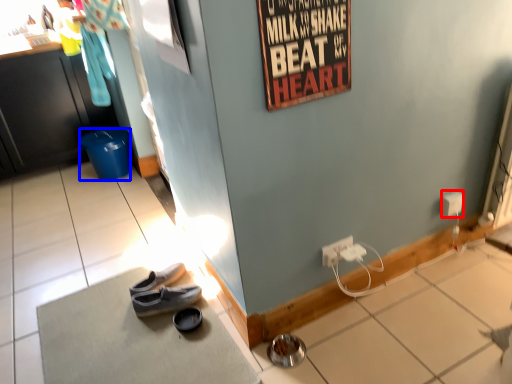
Question: Among these objects, which one is nearest to the camera, power outlet (highlighted by a red box) or trash bin/can (highlighted by a blue box)?

Choices:
 (A) power outlet
 (B) trash bin/can

Answer: (A)